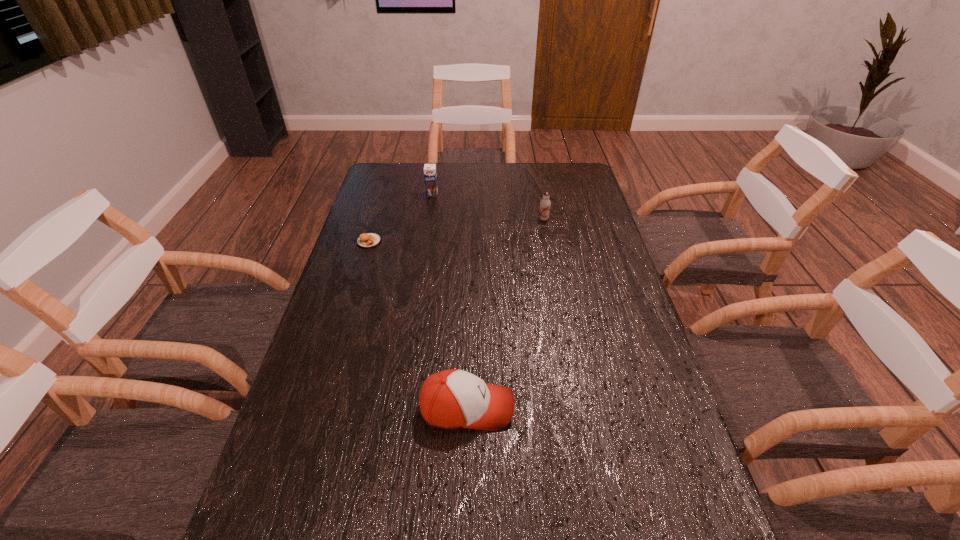
The height and width of the screenshot is (540, 960). Find the location of `free spot between the taller chocolate milk and the shortest object`. free spot between the taller chocolate milk and the shortest object is located at coordinates (400, 218).

Image resolution: width=960 pixels, height=540 pixels. In order to click on vacant area between the leftmost object and the taller chocolate milk in this screenshot , I will do `click(400, 218)`.

This screenshot has height=540, width=960. In order to click on blank region between the baseball cap and the second object from left to right in this screenshot , I will do `click(449, 301)`.

Identify the location of vacant space in between the third farthest object and the shorter chocolate milk. The image size is (960, 540). (456, 230).

Identify the location of vacant point located between the nearer chocolate milk and the shortest object. (456, 230).

The height and width of the screenshot is (540, 960). In order to click on free spot between the taller chocolate milk and the baseball cap in this screenshot , I will do `click(449, 301)`.

You are a GUI agent. You are given a task and a screenshot of the screen. Output one action in this format:
    pyautogui.click(x=<x>, y=<y>)
    Task: Click on the free space between the leftmost object and the rightmost object
    
    Given the screenshot: What is the action you would take?
    pyautogui.click(x=456, y=230)

You are a GUI agent. You are given a task and a screenshot of the screen. Output one action in this format:
    pyautogui.click(x=<x>, y=<y>)
    Task: Click on the object that is the third nearest to the third farthest object
    
    Given the screenshot: What is the action you would take?
    pyautogui.click(x=450, y=399)

Select which object appears as the closest to the second nearest object. Please provide its 2D coordinates. Your answer should be formatted as a tuple, i.e. [(x, y)], where the tuple contains the x and y coordinates of a point satisfying the conditions above.

[(430, 176)]

This screenshot has height=540, width=960. Identify the location of vacant area that satisfies the following two spatial constraints: 1. on the front label of the second farthest object; 2. on the right side of the farther chocolate milk. (428, 219).